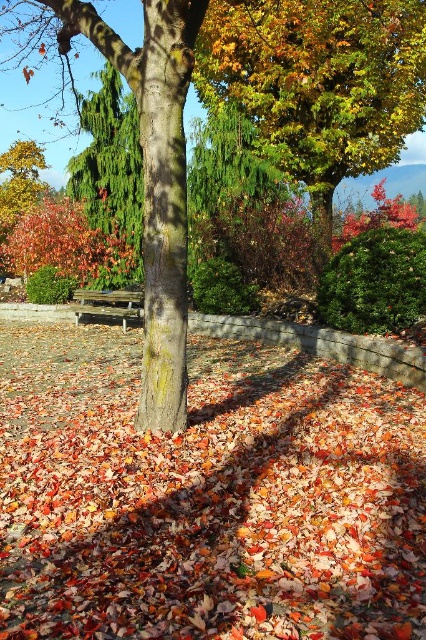
You are sitting on the brown wooden bench at center and want to look at the green textured evergreen tree at left. Can you see it clearly from your current position?

The brown wooden bench at center is behind the green textured evergreen tree at left, so you cannot see it clearly from your current position.

You are a gardener looking at the autumn scene. You see the shiny green leaves at upper center and the green textured evergreen tree at left. Which object is positioned to the right of the other?

The shiny green leaves at upper center is positioned to the right of the green textured evergreen tree at left.

You are an artist setting up your easel to paint the autumn scene. You want to focus on capturing the shiny green leaves at upper center and the brown wooden bench at center. Which object should you zoom in on more to ensure both fit in your painting?

The shiny green leaves at upper center are wider than the brown wooden bench at center, so you should zoom in more on the brown wooden bench at center to ensure both fit in your painting.